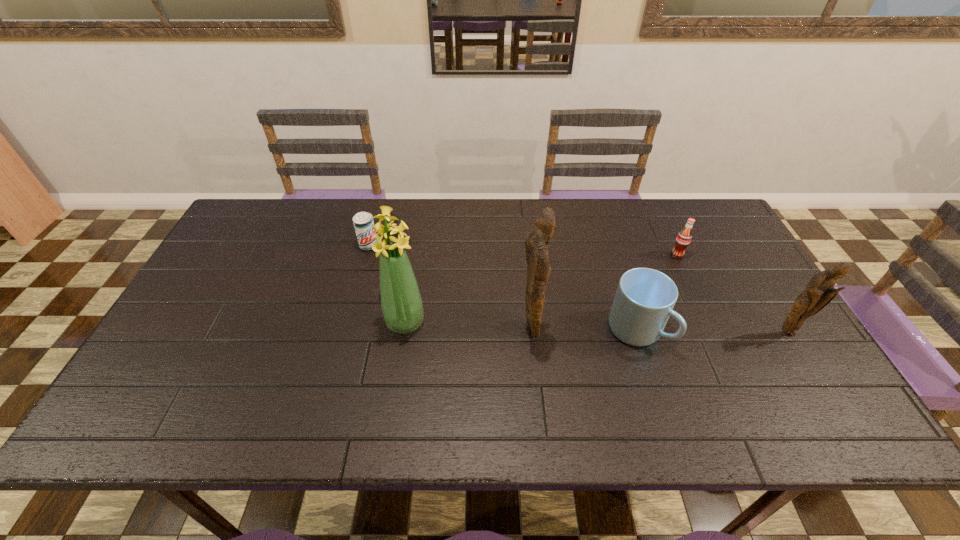
Identify which object is the fourth closest to the soda. Please provide its 2D coordinates. Your answer should be formatted as a tuple, i.e. [(x, y)], where the tuple contains the x and y coordinates of a point satisfying the conditions above.

[(401, 302)]